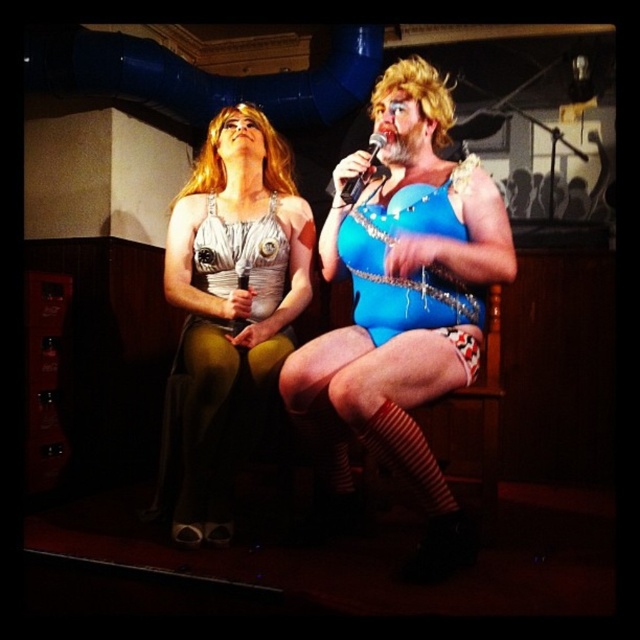
You are an audience member sitting in the front row. You notice two performers on stage wearing the blue shiny bodysuit at center and the matte silver dress at center. Which performer is positioned to the right of the other?

The blue shiny bodysuit at center is to the right of the matte silver dress at center.

You are a photographer in the audience of this stage performance. You want to take a photo of the blue shiny bodysuit at center, but there is a point at coordinates point (403,304) in your camera viewfinder. Can you tell me whether this point is on the blue shiny bodysuit at center?

The point (403,304) is on the blue shiny bodysuit at center, so yes, the point is on the blue shiny bodysuit at center.

You are a photographer positioned at the back of the stage. You need to capture a photo that includes both the blue shiny bodysuit at center and the matte silver dress at center. Based on their positions, which performer should you adjust your camera angle to focus on first to ensure both are in frame?

The blue shiny bodysuit at center might be wider than the matte silver dress at center, so you should focus on the blue shiny bodysuit at center first to accommodate its width and ensure both performers are fully visible in the frame.